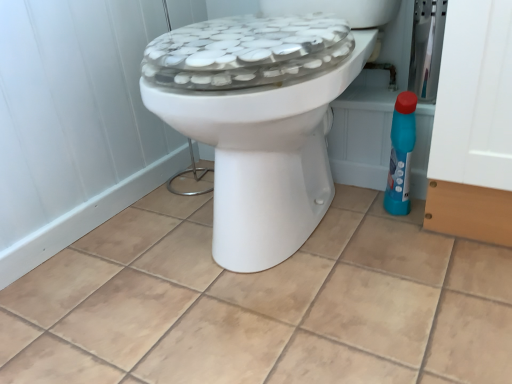
This screenshot has width=512, height=384. What are the coordinates of `vacant area that is in front of white glossy toilet at center` in the screenshot? It's located at click(314, 315).